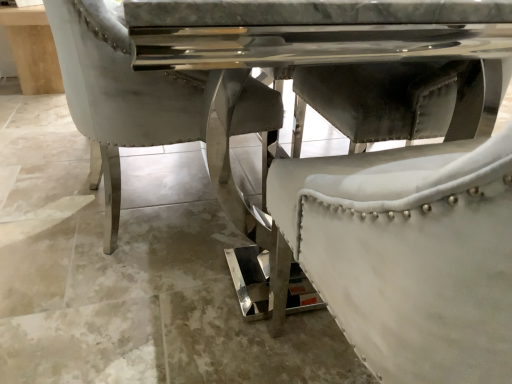
The image size is (512, 384). Describe the element at coordinates (131, 271) in the screenshot. I see `white leather chair at center` at that location.

Locate an element on the screen. The height and width of the screenshot is (384, 512). white leather chair at center is located at coordinates (131, 271).

Measure the distance between point (34, 17) and camera.

They are 2.44 meters apart.

The height and width of the screenshot is (384, 512). What do you see at coordinates (33, 49) in the screenshot?
I see `white leather table at upper center` at bounding box center [33, 49].

Locate an element on the screen. The height and width of the screenshot is (384, 512). white leather table at upper center is located at coordinates (33, 49).

This screenshot has height=384, width=512. I want to click on white leather chair at center, so (x=131, y=271).

Which object is positioned more to the right, white leather chair at center or white leather table at upper center?

white leather chair at center is more to the right.

Considering the relative positions of white leather chair at center and white leather table at upper center in the image provided, is white leather chair at center behind white leather table at upper center?

No, white leather chair at center is closer to the camera.

Which is in front, point (15, 379) or point (26, 9)?

Point (15, 379)

From the image's perspective, is white leather chair at center on top of white leather table at upper center?

No, from the image's perspective, white leather chair at center is not above white leather table at upper center.

From a real-world perspective, relative to white leather table at upper center, is white leather chair at center vertically above or below?

Clearly, from a real-world perspective, white leather chair at center is below white leather table at upper center.

Which of these two, white leather chair at center or white leather table at upper center, is wider?

With larger width is white leather chair at center.

Which of these two, white leather chair at center or white leather table at upper center, stands taller?

white leather table at upper center.

Considering the sizes of objects white leather chair at center and white leather table at upper center in the image provided, who is smaller, white leather chair at center or white leather table at upper center?

With smaller size is white leather table at upper center.

Could white leather table at upper center be considered to be inside white leather chair at center?

No, white leather table at upper center is not surrounded by white leather chair at center.

Does white leather chair at center touch white leather table at upper center?

white leather chair at center and white leather table at upper center are clearly separated.

Does white leather chair at center turn towards white leather table at upper center?

No.

Where is `table that is on the left side of white leather chair at center`? Image resolution: width=512 pixels, height=384 pixels. table that is on the left side of white leather chair at center is located at coordinates (33, 49).

Which object is positioned more to the right, white leather table at upper center or white leather chair at center?

white leather chair at center.

Who is more distant, white leather table at upper center or white leather chair at center?

white leather table at upper center is behind.

Between point (1, 25) and point (261, 345), which one is positioned in front?

Positioned in front is point (261, 345).

From the image's perspective, is white leather table at upper center above or below white leather chair at center?

Clearly, from the image's perspective, white leather table at upper center is above white leather chair at center.

From a real-world perspective, is white leather table at upper center positioned over white leather chair at center based on gravity?

Yes, from a real-world perspective, white leather table at upper center is above white leather chair at center.

Looking at this image, in terms of width, does white leather table at upper center look wider or thinner when compared to white leather chair at center?

Considering their sizes, white leather table at upper center looks slimmer than white leather chair at center.

Is white leather table at upper center taller than white leather chair at center?

Yes, white leather table at upper center is taller than white leather chair at center.

Which of these two, white leather table at upper center or white leather chair at center, is smaller?

With smaller size is white leather table at upper center.

Does white leather table at upper center contain white leather chair at center?

That's incorrect, white leather chair at center is not inside white leather table at upper center.

Is white leather table at upper center next to white leather chair at center?

No, white leather table at upper center is not with white leather chair at center.

Is white leather chair at center at the back of white leather table at upper center?

That's not correct — white leather table at upper center is not looking away from white leather chair at center.

Can you tell me how much white leather table at upper center and white leather chair at center differ in facing direction?

The facing directions of white leather table at upper center and white leather chair at center are 90.1 degrees apart.

Measure the distance from white leather table at upper center to white leather chair at center.

A distance of 4.47 feet exists between white leather table at upper center and white leather chair at center.

Locate an element on the screen. concrete in front of the white leather table at upper center is located at coordinates (131, 271).

The width and height of the screenshot is (512, 384). Identify the location of table above the white leather chair at center (from a real-world perspective). (33, 49).

Find the location of a particular element. The width and height of the screenshot is (512, 384). concrete lying on the right of white leather table at upper center is located at coordinates (131, 271).